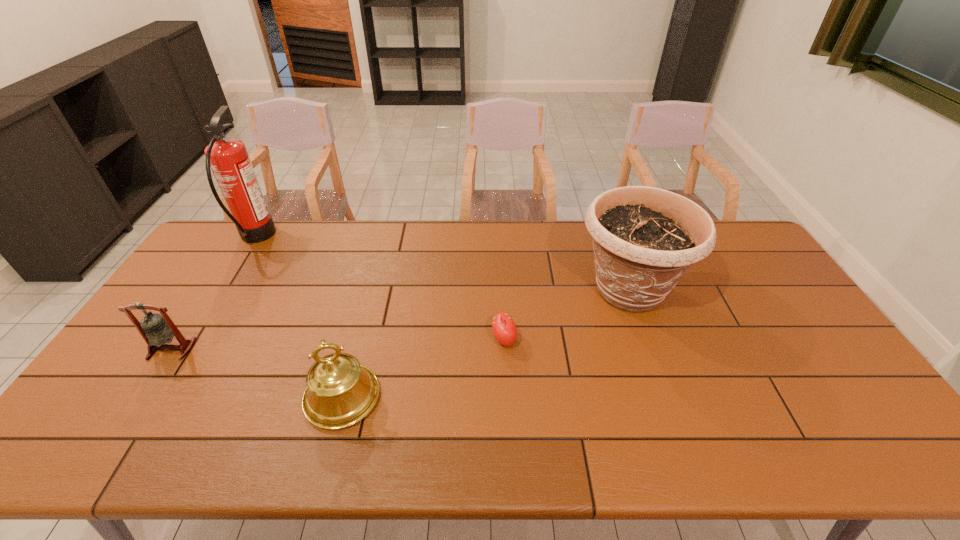
Locate an element on the screen. The height and width of the screenshot is (540, 960). vacant space located on the left of the rightmost object is located at coordinates (523, 290).

Where is `vacant area located on the left of the nearer bell`? vacant area located on the left of the nearer bell is located at coordinates (161, 397).

Locate an element on the screen. The width and height of the screenshot is (960, 540). vacant space located 0.060m on the back of the left bell is located at coordinates (190, 322).

Find the location of a particular element. The image size is (960, 540). vacant space located on the left of the shortest object is located at coordinates (382, 340).

In order to click on fire extinguisher that is positioned at the far edge in this screenshot , I will do 228,158.

Where is `flowerpot that is at the far edge`? The width and height of the screenshot is (960, 540). flowerpot that is at the far edge is located at coordinates (645, 239).

Locate an element on the screen. This screenshot has width=960, height=540. object at the near edge is located at coordinates (340, 392).

Image resolution: width=960 pixels, height=540 pixels. Find the location of `fire extinguisher at the left edge`. fire extinguisher at the left edge is located at coordinates (228, 158).

The height and width of the screenshot is (540, 960). Find the location of `bell located in the left edge section of the desktop`. bell located in the left edge section of the desktop is located at coordinates (156, 330).

Where is `object at the far left corner`? The width and height of the screenshot is (960, 540). object at the far left corner is located at coordinates (228, 158).